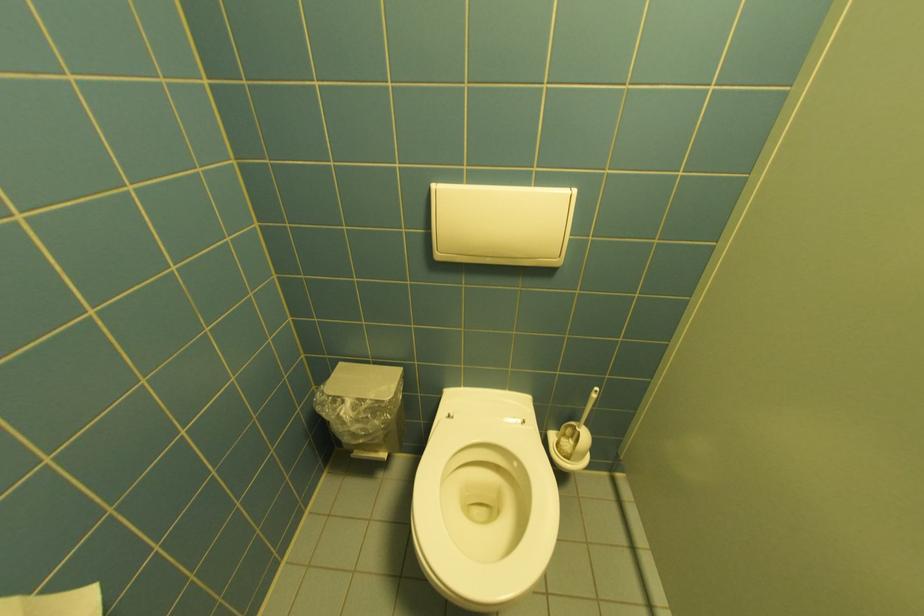
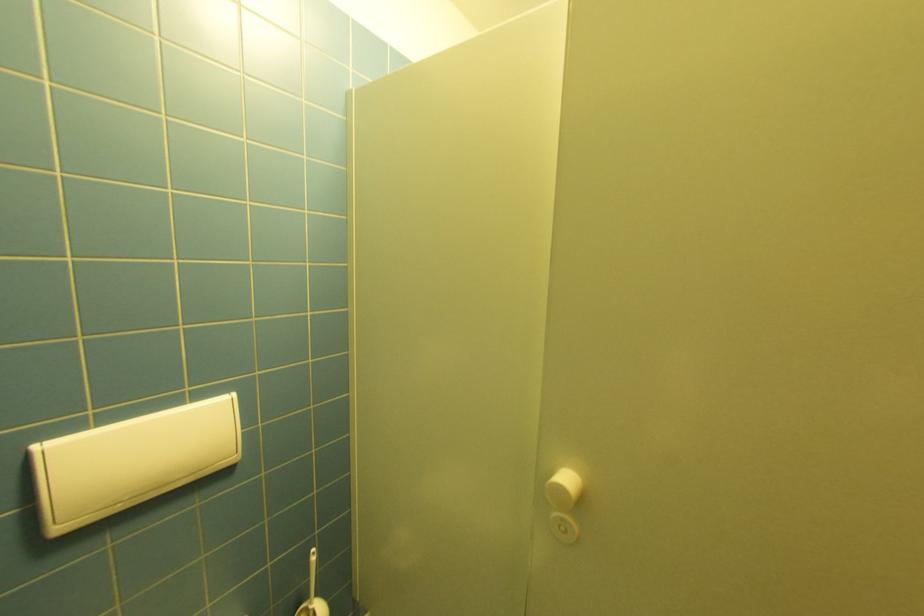
In the second image, find the point that corresponds to point (580, 429) in the first image.

(312, 610)